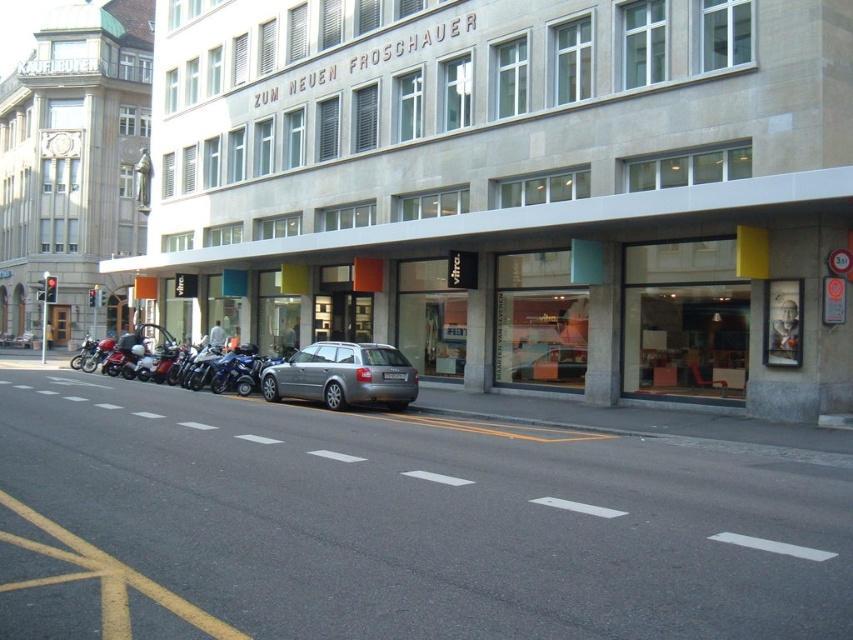
Between point (669, 145) and point (318, 353), which one is positioned in front?

Point (669, 145) is more forward.

The height and width of the screenshot is (640, 853). Describe the element at coordinates (518, 188) in the screenshot. I see `silver metallic car at center` at that location.

Between point (563, 136) and point (316, 397), which one is positioned behind?

Point (563, 136)

Identify the location of silver metallic car at center. The image size is (853, 640). (518, 188).